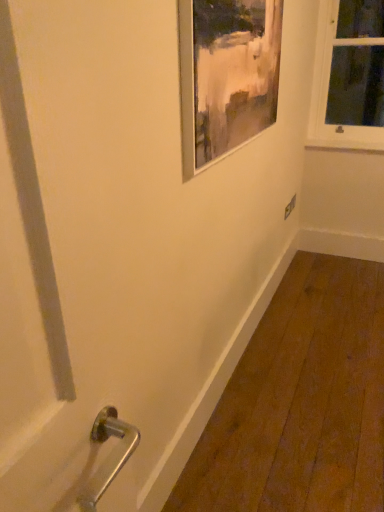
Question: Which direction should I rotate to look at metallic silver picture frame at upper center?

Choices:
 (A) right
 (B) left

Answer: (A)

Question: Is white matte window sill at upper right closer to camera compared to metallic silver picture frame at upper center?

Choices:
 (A) no
 (B) yes

Answer: (A)

Question: Does white matte window sill at upper right have a larger size compared to metallic silver picture frame at upper center?

Choices:
 (A) no
 (B) yes

Answer: (A)

Question: Is white matte window sill at upper right outside metallic silver picture frame at upper center?

Choices:
 (A) no
 (B) yes

Answer: (B)

Question: Does white matte window sill at upper right have a smaller size compared to metallic silver picture frame at upper center?

Choices:
 (A) no
 (B) yes

Answer: (B)

Question: Is white matte window sill at upper right further to the viewer compared to metallic silver picture frame at upper center?

Choices:
 (A) yes
 (B) no

Answer: (A)

Question: From a real-world perspective, is white matte window sill at upper right on metallic silver picture frame at upper center?

Choices:
 (A) no
 (B) yes

Answer: (A)

Question: Considering the relative sizes of metallic silver picture frame at upper center and white wooden window at upper right in the image provided, is metallic silver picture frame at upper center wider than white wooden window at upper right?

Choices:
 (A) no
 (B) yes

Answer: (A)

Question: Does metallic silver picture frame at upper center have a larger size compared to white wooden window at upper right?

Choices:
 (A) no
 (B) yes

Answer: (A)

Question: Considering the relative sizes of metallic silver picture frame at upper center and white wooden window at upper right in the image provided, is metallic silver picture frame at upper center taller than white wooden window at upper right?

Choices:
 (A) yes
 (B) no

Answer: (B)

Question: From a real-world perspective, is metallic silver picture frame at upper center below white wooden window at upper right?

Choices:
 (A) no
 (B) yes

Answer: (A)

Question: Can you confirm if metallic silver picture frame at upper center is positioned to the left of white wooden window at upper right?

Choices:
 (A) yes
 (B) no

Answer: (A)

Question: Is white wooden window at upper right located within metallic silver picture frame at upper center?

Choices:
 (A) yes
 (B) no

Answer: (B)

Question: Is the position of white wooden window at upper right less distant than that of white matte window sill at upper right?

Choices:
 (A) no
 (B) yes

Answer: (B)